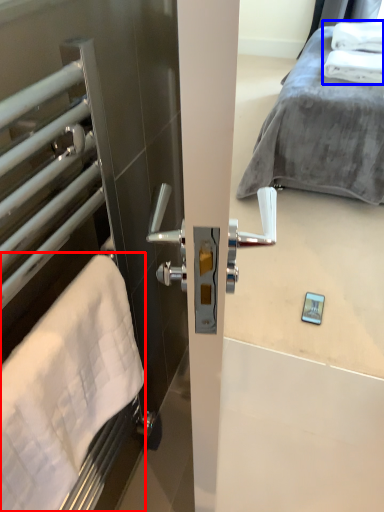
Question: Among these objects, which one is nearest to the camera, bath towel (highlighted by a red box) or bath towel (highlighted by a blue box)?

Choices:
 (A) bath towel
 (B) bath towel

Answer: (A)